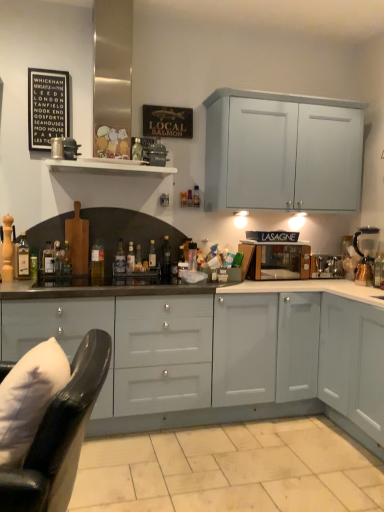
Identify the location of free space to the right of translucent glass bottle at center, arranged as the 8th bottle when viewed from the left. Image resolution: width=384 pixels, height=512 pixels. (146, 281).